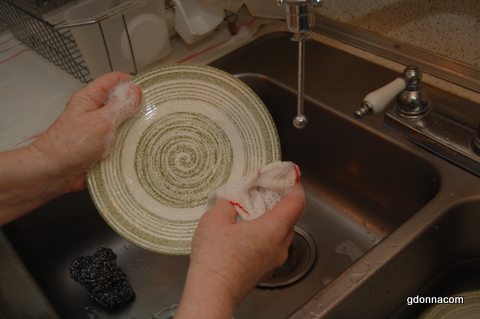
I want to click on plastic utensil dryer, so click(x=155, y=8).